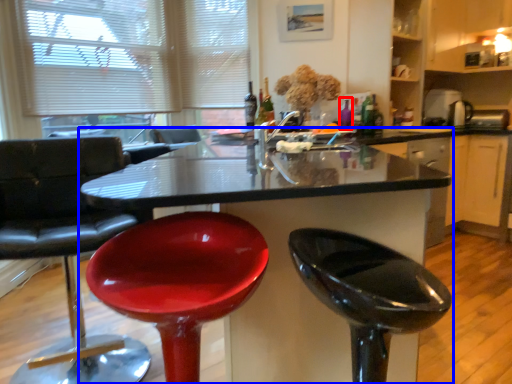
Question: Which object appears farthest to the camera in this image, bottle (highlighted by a red box) or kitchen & dining room table (highlighted by a blue box)?

Choices:
 (A) bottle
 (B) kitchen & dining room table

Answer: (A)